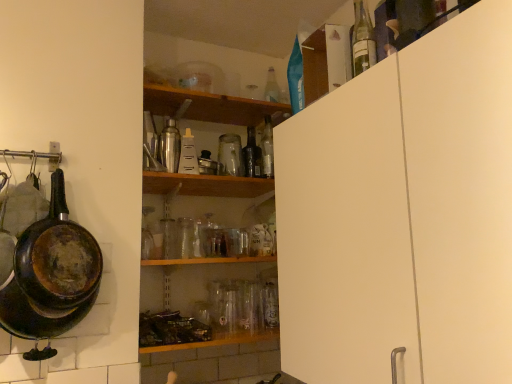
Question: From a real-world perspective, relative to rusty cast iron frying pan at left, is metallic silver shaker at center, the fifth bottle viewed from the back, vertically above or below?

Choices:
 (A) below
 (B) above

Answer: (B)

Question: In the image, is metallic silver shaker at center, positioned as the second bottle in front-to-back order, positioned in front of or behind rusty cast iron frying pan at left?

Choices:
 (A) front
 (B) behind

Answer: (B)

Question: Considering the real-world distances, which object is closest to the rusty cast iron frying pan at left?

Choices:
 (A) clear glass bottle at upper right, the 6th bottle from the left
 (B) brushed metal shaker at upper center, which appears as the 2th bottle when viewed from the left
 (C) black glass bottle at center, arranged as the third bottle when viewed from the right
 (D) clear glass bottle at upper center, marked as the 5th bottle in a left-to-right arrangement
 (E) metallic silver shaker at center, the fifth bottle viewed from the back

Answer: (E)

Question: Estimate the real-world distances between objects in this image. Which object is closer to the rusty cast iron frying pan at left?

Choices:
 (A) brushed metal shaker at upper center, which appears as the fourth bottle when viewed from the back
 (B) metallic silver shaker at center, which is counted as the 1th bottle, starting from the left
 (C) clear plastic bottle at center, which is the 3th bottle in back-to-front order
 (D) clear plastic bottle at upper right
 (E) clear glass bottle at upper right, which appears as the 1th bottle when viewed from the right

Answer: (B)